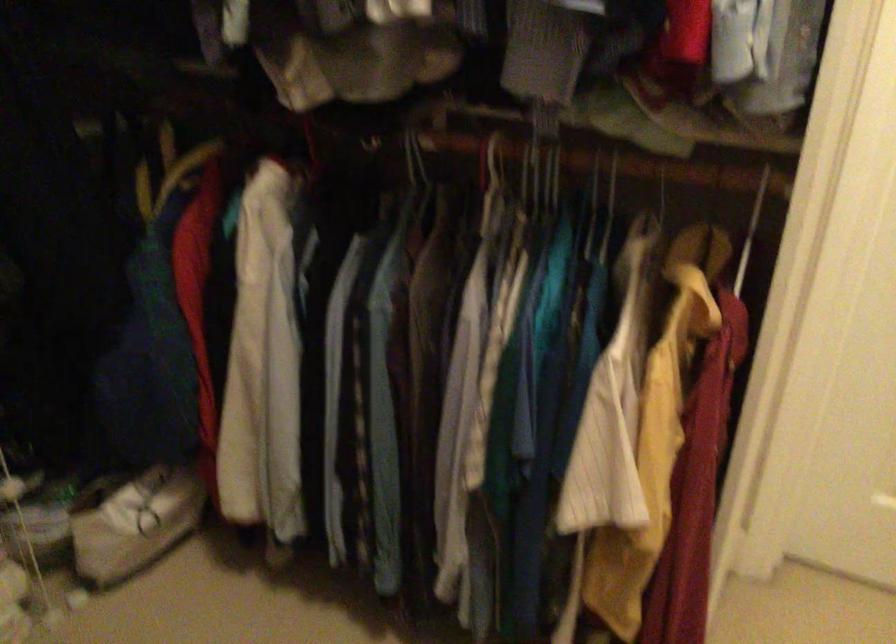
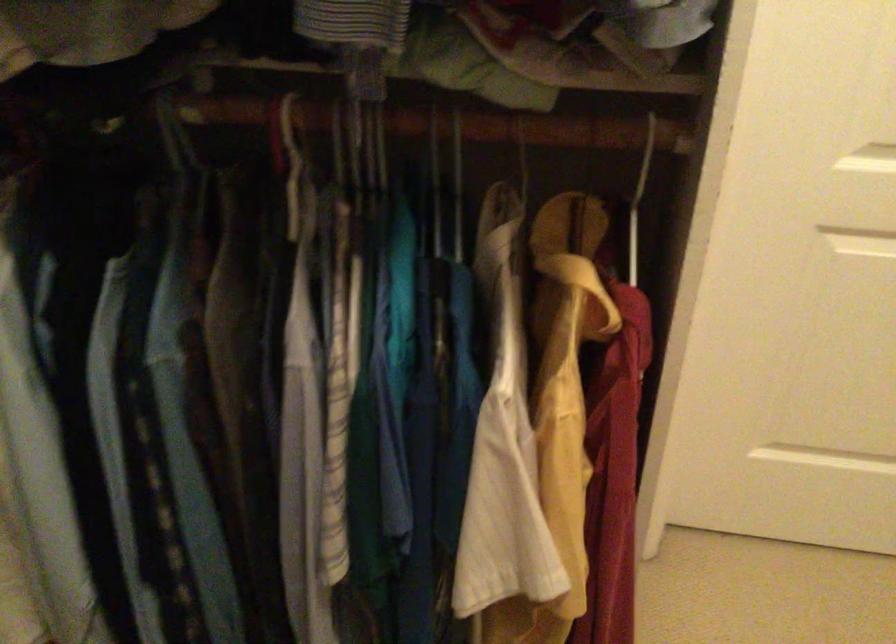
Find the pixel in the second image that matches (x=609, y=210) in the first image.

(441, 176)